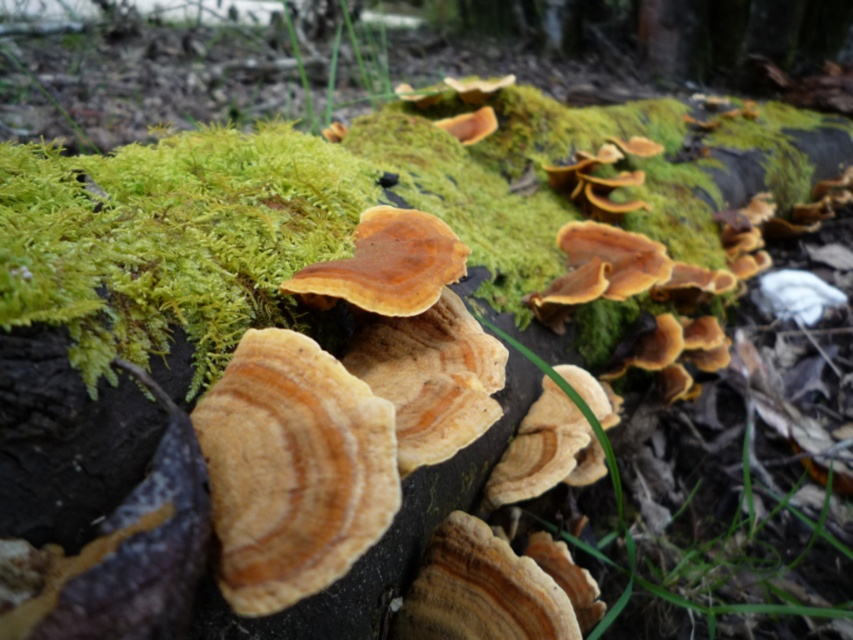
Who is taller, light brown textured fungus at center or brown wood grain fungi at center?

With more height is light brown textured fungus at center.

Describe the element at coordinates (292, 468) in the screenshot. I see `light brown textured fungus at center` at that location.

In order to click on light brown textured fungus at center in this screenshot , I will do `click(292, 468)`.